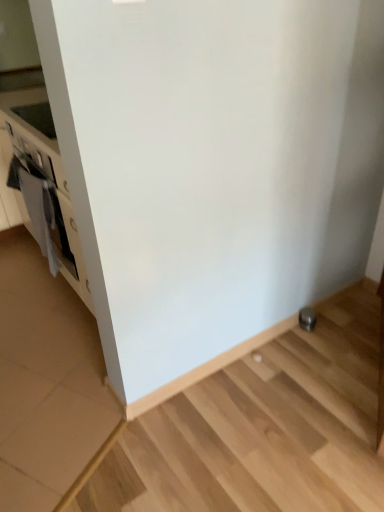
Question: Is the depth of white matte oven at left greater than that of satin silver knob at lower right?

Choices:
 (A) yes
 (B) no

Answer: (B)

Question: Is satin silver knob at lower right at the back of white matte oven at left?

Choices:
 (A) yes
 (B) no

Answer: (B)

Question: Does white matte oven at left turn towards satin silver knob at lower right?

Choices:
 (A) yes
 (B) no

Answer: (B)

Question: Can you confirm if white matte oven at left is positioned to the right of satin silver knob at lower right?

Choices:
 (A) no
 (B) yes

Answer: (A)

Question: Is white matte oven at left far away from satin silver knob at lower right?

Choices:
 (A) yes
 (B) no

Answer: (A)

Question: Is the depth of white matte oven at left less than that of satin silver knob at lower right?

Choices:
 (A) yes
 (B) no

Answer: (A)

Question: Is satin silver knob at lower right shorter than white matte oven at left?

Choices:
 (A) no
 (B) yes

Answer: (B)

Question: Is satin silver knob at lower right wider than white matte oven at left?

Choices:
 (A) yes
 (B) no

Answer: (B)

Question: From the image's perspective, would you say satin silver knob at lower right is positioned over white matte oven at left?

Choices:
 (A) no
 (B) yes

Answer: (A)

Question: From the image's perspective, is satin silver knob at lower right under white matte oven at left?

Choices:
 (A) yes
 (B) no

Answer: (A)

Question: From a real-world perspective, is satin silver knob at lower right over white matte oven at left?

Choices:
 (A) no
 (B) yes

Answer: (A)

Question: Is satin silver knob at lower right further to the viewer compared to white matte oven at left?

Choices:
 (A) yes
 (B) no

Answer: (A)

Question: In terms of height, does white matte oven at left look taller or shorter compared to satin silver knob at lower right?

Choices:
 (A) tall
 (B) short

Answer: (A)